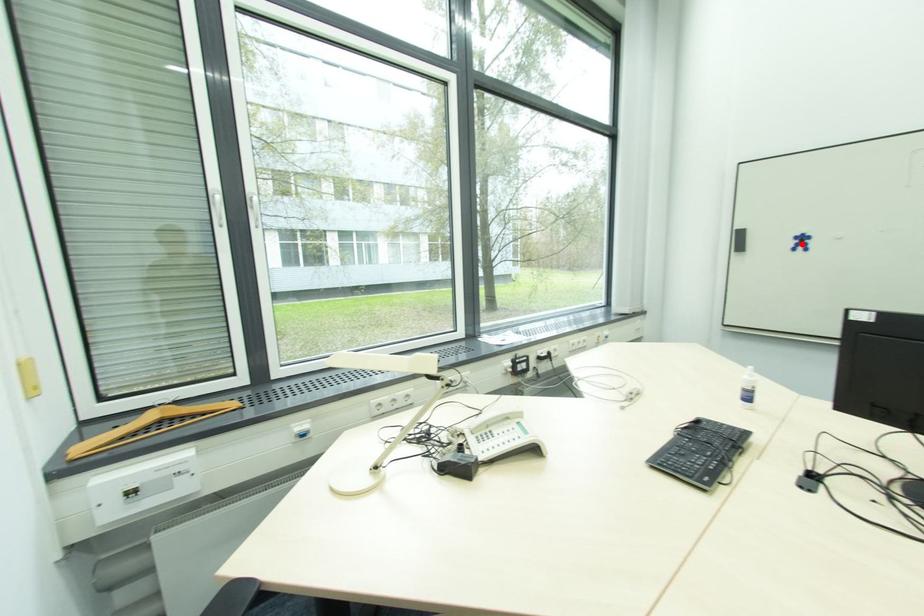
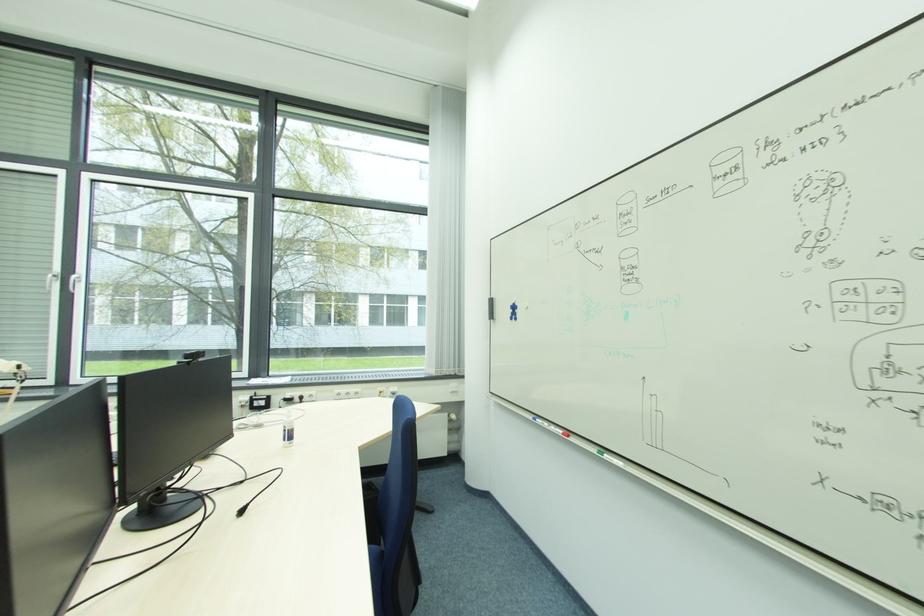
In the second image, find the point that corresponds to the highlighted location in the first image.

(515, 313)